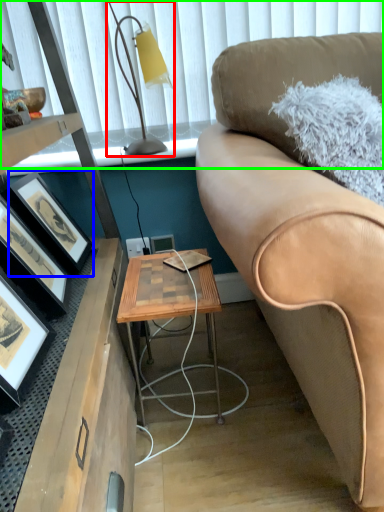
Question: Which object is positioned closest to table lamp (highlighted by a red box)? Select from picture frame (highlighted by a blue box) and window screen (highlighted by a green box).

Choices:
 (A) picture frame
 (B) window screen

Answer: (B)